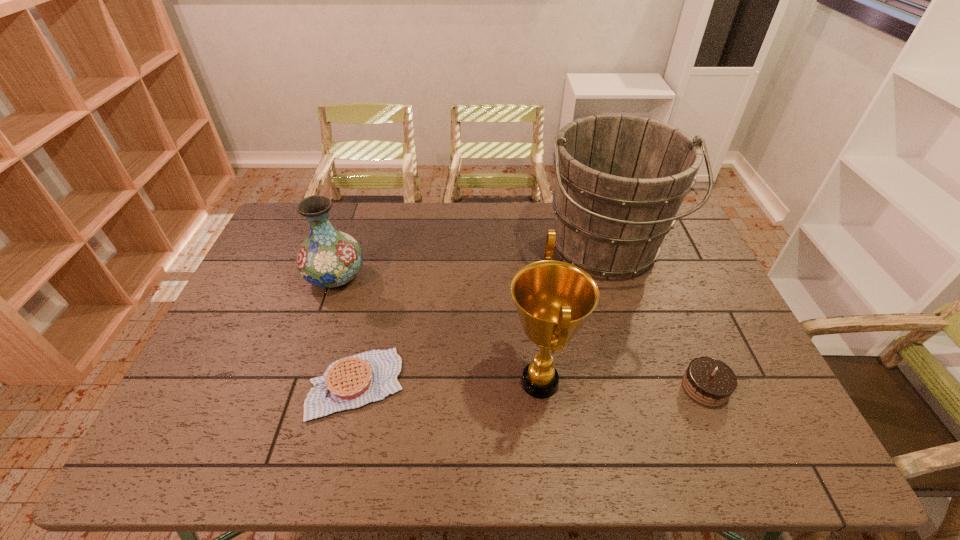
The width and height of the screenshot is (960, 540). Identify the location of free spot that satisfies the following two spatial constraints: 1. on the handle side of the bucket; 2. on the right side of the chocolate cake. (647, 387).

You are a GUI agent. You are given a task and a screenshot of the screen. Output one action in this format:
    pyautogui.click(x=<x>, y=<y>)
    Task: Click on the free spot that satisfies the following two spatial constraints: 1. on the front side of the vase; 2. on the left side of the chocolate cake
    The width and height of the screenshot is (960, 540).
    Given the screenshot: What is the action you would take?
    pyautogui.click(x=298, y=387)

Locate an element on the screen. This screenshot has width=960, height=540. vacant region that satisfies the following two spatial constraints: 1. on the front view with handles of the chocolate cake; 2. on the left side of the award is located at coordinates (540, 387).

This screenshot has height=540, width=960. I want to click on free location that satisfies the following two spatial constraints: 1. on the front view with handles of the award; 2. on the right side of the second shortest object, so click(x=540, y=387).

This screenshot has height=540, width=960. Find the location of `vacant space that satisfies the following two spatial constraints: 1. on the handle side of the chocolate cake; 2. on the right side of the bucket`. vacant space that satisfies the following two spatial constraints: 1. on the handle side of the chocolate cake; 2. on the right side of the bucket is located at coordinates pyautogui.click(x=647, y=387).